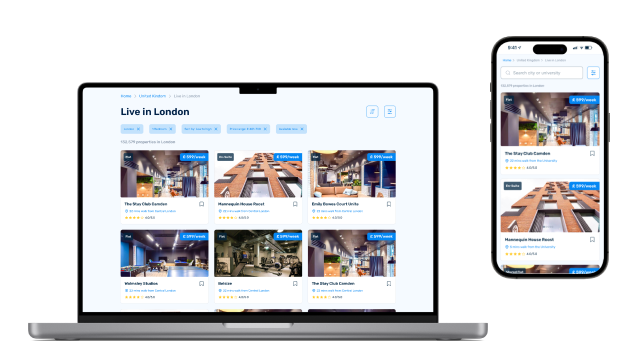
Identify the location of light fixtures. The width and height of the screenshot is (636, 364). (523, 109), (540, 115).